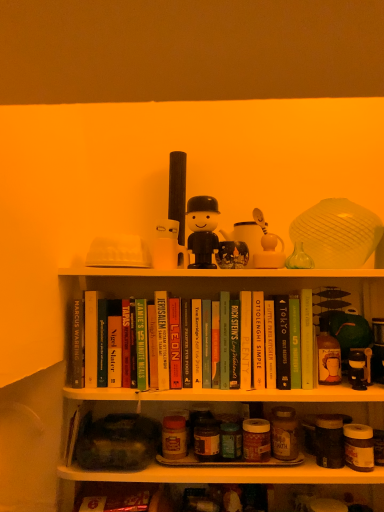
Locate an element on the screen. This screenshot has width=384, height=512. free space in front of hardcover book at center, which is counted as the 8th paperback book, starting from the right is located at coordinates (197, 389).